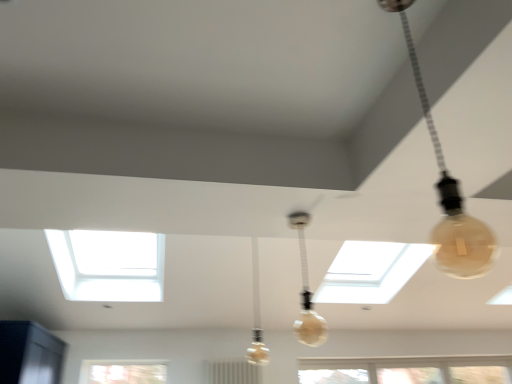
I want to click on translucent glass bulb at upper right, the 3th lamp when ordered from back to front, so click(450, 195).

Where is `translucent glass bulb at center, which is counted as the third lamp, starting from the top`? This screenshot has height=384, width=512. translucent glass bulb at center, which is counted as the third lamp, starting from the top is located at coordinates (257, 316).

Identify the location of translucent glass bulb at upper right, which is counted as the 3th lamp, starting from the left. The image size is (512, 384). (450, 195).

Is translucent glass bulb at center, acting as the second lamp starting from the right, positioned before translucent glass bulb at center, placed as the 1th lamp when sorted from bottom to top?

That is True.

Is translucent glass bulb at center, acting as the second lamp starting from the back, smaller than translucent glass bulb at center, which is the 3th lamp from right to left?

Indeed, translucent glass bulb at center, acting as the second lamp starting from the back, has a smaller size compared to translucent glass bulb at center, which is the 3th lamp from right to left.

Image resolution: width=512 pixels, height=384 pixels. Find the location of `lamp below the translucent glass bulb at center, the 2th lamp positioned from the left (from the image's perspective)`. lamp below the translucent glass bulb at center, the 2th lamp positioned from the left (from the image's perspective) is located at coordinates (257, 316).

From a real-world perspective, which is physically below, translucent glass bulb at center, placed as the second lamp when sorted from bottom to top, or translucent glass bulb at center, placed as the 1th lamp when sorted from bottom to top?

From a 3D spatial view, translucent glass bulb at center, placed as the second lamp when sorted from bottom to top, is below.

Image resolution: width=512 pixels, height=384 pixels. In order to click on lamp that appears in front of the translucent glass bulb at center, acting as the second lamp starting from the right in this screenshot , I will do `click(450, 195)`.

Looking at this image, is the position of translucent glass bulb at upper right, the 1th lamp viewed from the front, more distant than that of translucent glass bulb at center, placed as the second lamp when sorted from bottom to top?

No, translucent glass bulb at upper right, the 1th lamp viewed from the front, is in front of translucent glass bulb at center, placed as the second lamp when sorted from bottom to top.

What's the angular difference between translucent glass bulb at upper right, which is counted as the 3th lamp, starting from the left, and translucent glass bulb at center, acting as the second lamp starting from the back,'s facing directions?

translucent glass bulb at upper right, which is counted as the 3th lamp, starting from the left, and translucent glass bulb at center, acting as the second lamp starting from the back, are facing 92.5 degrees away from each other.

From a real-world perspective, who is located higher, translucent glass bulb at upper right, the first lamp positioned from the right, or translucent glass bulb at center, the 2th lamp positioned from the left?

From a 3D spatial view, translucent glass bulb at upper right, the first lamp positioned from the right, is above.

Consider the image. Who is bigger, translucent glass bulb at center, acting as the 2th lamp starting from the top, or translucent glass bulb at upper right, arranged as the 3th lamp when ordered from the bottom?

translucent glass bulb at upper right, arranged as the 3th lamp when ordered from the bottom.

Is translucent glass bulb at center, placed as the second lamp when sorted from bottom to top, inside the boundaries of translucent glass bulb at upper right, arranged as the 3th lamp when ordered from the bottom, or outside?

translucent glass bulb at center, placed as the second lamp when sorted from bottom to top, is not inside translucent glass bulb at upper right, arranged as the 3th lamp when ordered from the bottom, it's outside.

Is translucent glass bulb at center, placed as the second lamp when sorted from bottom to top, oriented away from translucent glass bulb at upper right, the first lamp positioned from the right?

Correct, translucent glass bulb at center, placed as the second lamp when sorted from bottom to top, is looking away from translucent glass bulb at upper right, the first lamp positioned from the right.

In terms of width, does translucent glass bulb at center, the 2th lamp positioned from the left, look wider or thinner when compared to translucent glass bulb at upper right, arranged as the 3th lamp when ordered from the bottom?

translucent glass bulb at center, the 2th lamp positioned from the left, is thinner than translucent glass bulb at upper right, arranged as the 3th lamp when ordered from the bottom.

Would you say translucent glass bulb at center, which is counted as the third lamp, starting from the top, is outside translucent glass bulb at upper right, the 3th lamp when ordered from back to front?

Indeed, translucent glass bulb at center, which is counted as the third lamp, starting from the top, is completely outside translucent glass bulb at upper right, the 3th lamp when ordered from back to front.

Who is more distant, translucent glass bulb at center, placed as the 1th lamp when sorted from bottom to top, or translucent glass bulb at upper right, arranged as the 3th lamp when ordered from the bottom?

translucent glass bulb at center, placed as the 1th lamp when sorted from bottom to top, is more distant.

From the image's perspective, is translucent glass bulb at center, the third lamp viewed from the front, on translucent glass bulb at upper right, the 3th lamp when ordered from back to front?

Actually, translucent glass bulb at center, the third lamp viewed from the front, appears below translucent glass bulb at upper right, the 3th lamp when ordered from back to front, in the image.

Could you tell me if translucent glass bulb at center, which is counted as the third lamp, starting from the top, is turned towards translucent glass bulb at upper right, the first lamp positioned from the right?

Yes, translucent glass bulb at center, which is counted as the third lamp, starting from the top, is facing translucent glass bulb at upper right, the first lamp positioned from the right.

Is point (439, 163) farther from viewer compared to point (258, 257)?

No, (439, 163) is closer to viewer.

From the image's perspective, is translucent glass bulb at upper right, the first lamp positioned from the right, located above or below translucent glass bulb at center, the third lamp viewed from the front?

Based on their image positions, translucent glass bulb at upper right, the first lamp positioned from the right, is located above translucent glass bulb at center, the third lamp viewed from the front.

Can you confirm if translucent glass bulb at upper right, the 1th lamp viewed from the front, is thinner than translucent glass bulb at center, which is the 3th lamp from right to left?

Correct, the width of translucent glass bulb at upper right, the 1th lamp viewed from the front, is less than that of translucent glass bulb at center, which is the 3th lamp from right to left.

Can translucent glass bulb at center, acting as the second lamp starting from the right, be found inside translucent glass bulb at center, which is counted as the third lamp, starting from the top?

No, translucent glass bulb at center, acting as the second lamp starting from the right, is not a part of translucent glass bulb at center, which is counted as the third lamp, starting from the top.

What are the coordinates of `lamp that is the 1st object located in front of the translucent glass bulb at center, placed as the 1th lamp when sorted from back to front` in the screenshot? It's located at (306, 291).

From a real-world perspective, is translucent glass bulb at center, placed as the 1th lamp when sorted from back to front, physically located above or below translucent glass bulb at center, placed as the second lamp when sorted from bottom to top?

translucent glass bulb at center, placed as the 1th lamp when sorted from back to front, is above translucent glass bulb at center, placed as the second lamp when sorted from bottom to top.

From the image's perspective, is translucent glass bulb at center, placed as the 1th lamp when sorted from back to front, beneath translucent glass bulb at center, acting as the second lamp starting from the right?

Yes.

You are a GUI agent. You are given a task and a screenshot of the screen. Output one action in this format:
    pyautogui.click(x=<x>, y=<y>)
    Task: Click on the lamp below the translucent glass bulb at center, acting as the second lamp starting from the back (from the image's perspective)
    This screenshot has height=384, width=512.
    Given the screenshot: What is the action you would take?
    pyautogui.click(x=257, y=316)

I want to click on lamp lying on the right of translucent glass bulb at center, acting as the second lamp starting from the right, so click(x=450, y=195).

Based on their spatial positions, is translucent glass bulb at center, acting as the 2th lamp starting from the top, or translucent glass bulb at upper right, the 3th lamp when ordered from back to front, closer to translucent glass bulb at center, placed as the 1th lamp when sorted from back to front?

translucent glass bulb at center, acting as the 2th lamp starting from the top, lies closer to translucent glass bulb at center, placed as the 1th lamp when sorted from back to front, than the other object.

Considering their positions, is translucent glass bulb at center, the third lamp viewed from the front, positioned further to translucent glass bulb at center, acting as the 2th lamp starting from the top, than translucent glass bulb at upper right, which is counted as the 3th lamp, starting from the left?

The object further to translucent glass bulb at center, acting as the 2th lamp starting from the top, is translucent glass bulb at upper right, which is counted as the 3th lamp, starting from the left.

Based on their spatial positions, is translucent glass bulb at center, placed as the 1th lamp when sorted from back to front, or translucent glass bulb at center, the 2th lamp positioned from the left, further from translucent glass bulb at upper right, the 1th lamp viewed from the front?

translucent glass bulb at center, placed as the 1th lamp when sorted from back to front, is positioned further to the anchor translucent glass bulb at upper right, the 1th lamp viewed from the front.

When comparing their distances from translucent glass bulb at center, placed as the 1th lamp when sorted from bottom to top, does translucent glass bulb at upper right, the 3th lamp when ordered from back to front, or translucent glass bulb at center, placed as the second lamp when sorted from bottom to top, seem further?

translucent glass bulb at upper right, the 3th lamp when ordered from back to front, lies further to translucent glass bulb at center, placed as the 1th lamp when sorted from bottom to top, than the other object.

Looking at the image, which one is located further to translucent glass bulb at center, acting as the second lamp starting from the right, translucent glass bulb at upper right, which is counted as the 3th lamp, starting from the left, or translucent glass bulb at center, placed as the 1th lamp when sorted from back to front?

The object further to translucent glass bulb at center, acting as the second lamp starting from the right, is translucent glass bulb at upper right, which is counted as the 3th lamp, starting from the left.

When comparing their distances from translucent glass bulb at upper right, arranged as the 3th lamp when ordered from the bottom, does translucent glass bulb at center, the 2th lamp in the front-to-back sequence, or translucent glass bulb at center, which is counted as the third lamp, starting from the top, seem further?

The object further to translucent glass bulb at upper right, arranged as the 3th lamp when ordered from the bottom, is translucent glass bulb at center, which is counted as the third lamp, starting from the top.

Where is `lamp between translucent glass bulb at upper right, which is counted as the 3th lamp, starting from the left, and translucent glass bulb at center, which ranks as the first lamp in left-to-right order, along the z-axis`? The image size is (512, 384). lamp between translucent glass bulb at upper right, which is counted as the 3th lamp, starting from the left, and translucent glass bulb at center, which ranks as the first lamp in left-to-right order, along the z-axis is located at coordinates (306, 291).